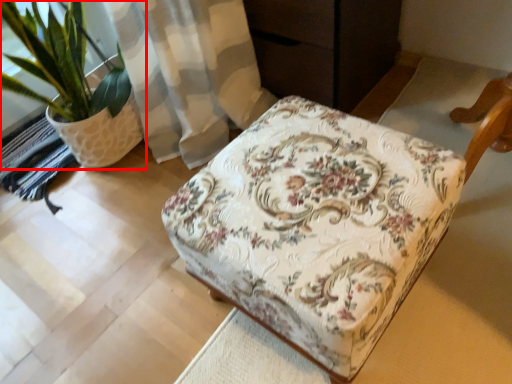
Question: Considering the relative positions of houseplant (annotated by the red box) and furniture in the image provided, where is houseplant (annotated by the red box) located with respect to the staircase?

Choices:
 (A) left
 (B) right

Answer: (A)